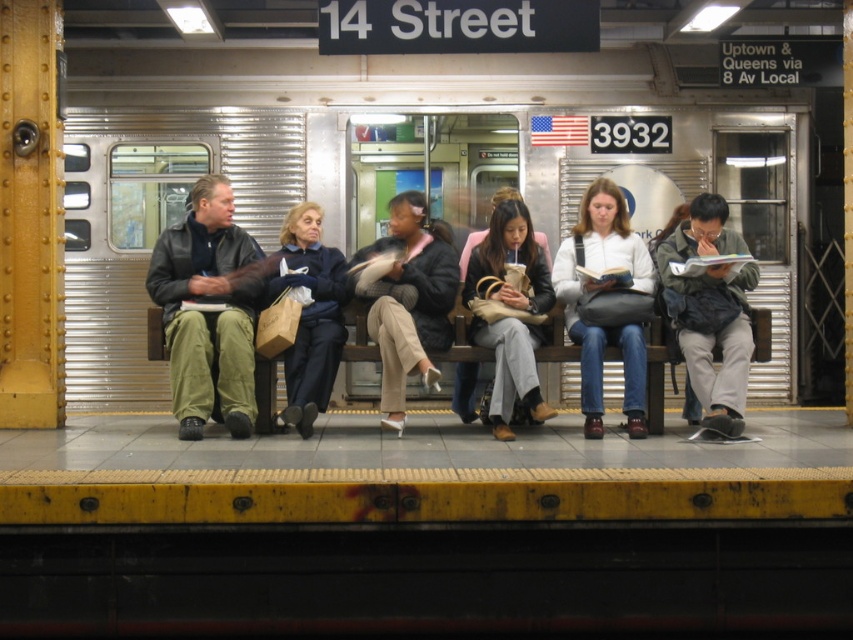
Question: Can you confirm if white matte jacket at center is bigger than wooden bench at center?

Choices:
 (A) yes
 (B) no

Answer: (A)

Question: Which point is closer to the camera taking this photo?

Choices:
 (A) (206, 280)
 (B) (744, 376)

Answer: (B)

Question: Which object is the farthest from the white matte jacket at center?

Choices:
 (A) silver metallic train at center
 (B) dark gray backpack at center
 (C) black leather jacket at center

Answer: (A)

Question: Where is dark gray backpack at center located in relation to dark blue sweater at center in the image?

Choices:
 (A) left
 (B) right

Answer: (B)

Question: Which object is positioned closest to the dark blue sweater at center?

Choices:
 (A) black leather jacket at center
 (B) matte black jacket at center
 (C) silver metallic train at center

Answer: (A)

Question: Does dark gray backpack at center have a smaller size compared to matte black jacket at center?

Choices:
 (A) yes
 (B) no

Answer: (A)